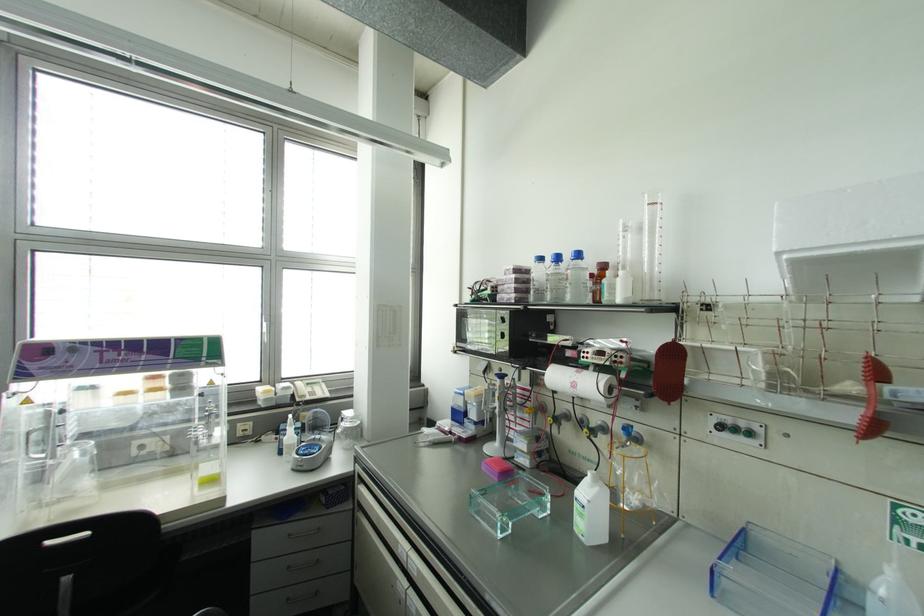
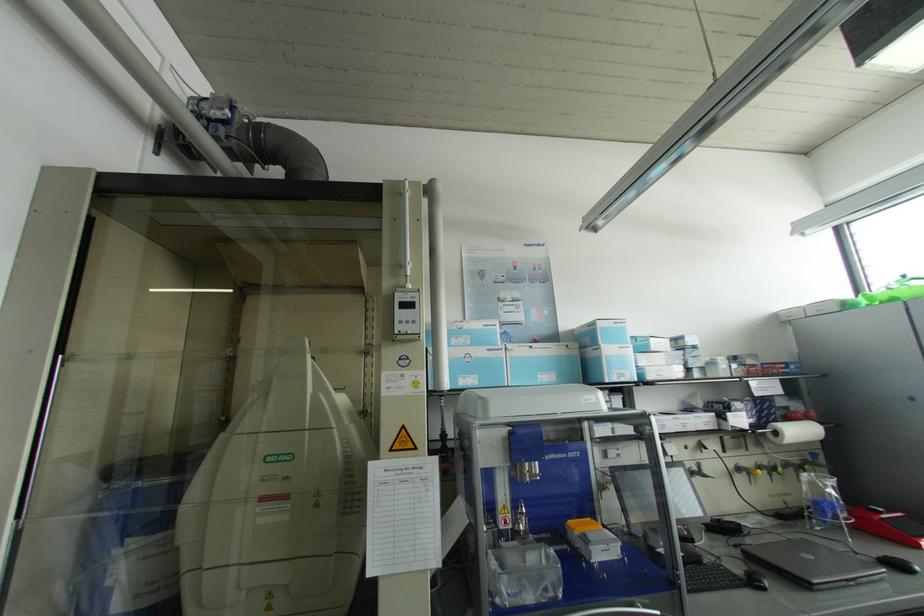
Question: The camera is either moving clockwise (left) or counter-clockwise (right) around the object. The first image is from the beginning of the video and the second image is from the end. Is the camera moving left or right when shooting the video?

Choices:
 (A) Left
 (B) Right

Answer: (B)